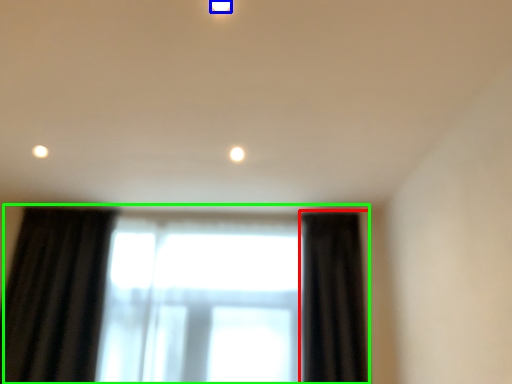
Question: Estimate the real-world distances between objects in this image. Which object is farther from curtain (highlighted by a red box), lighting (highlighted by a blue box) or window (highlighted by a green box)?

Choices:
 (A) lighting
 (B) window

Answer: (A)